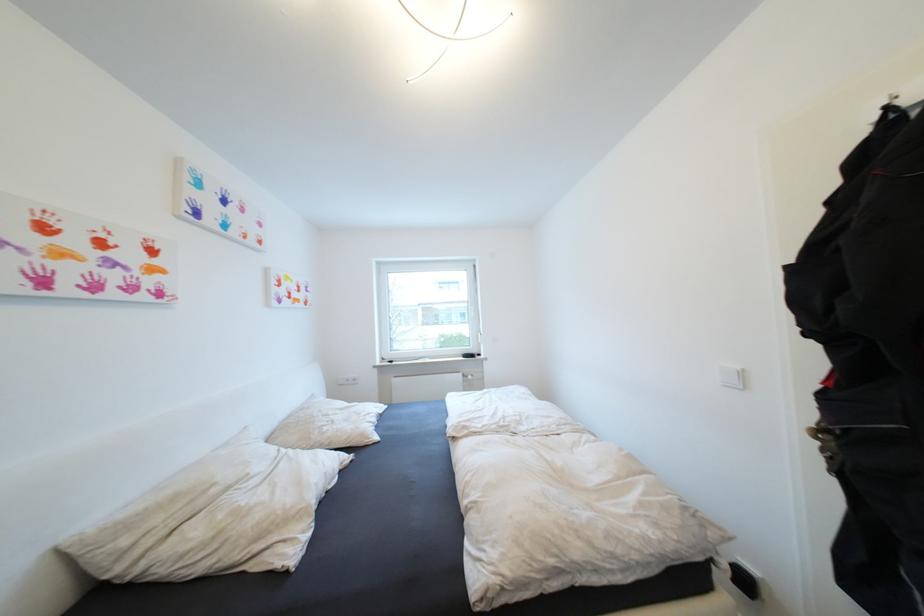
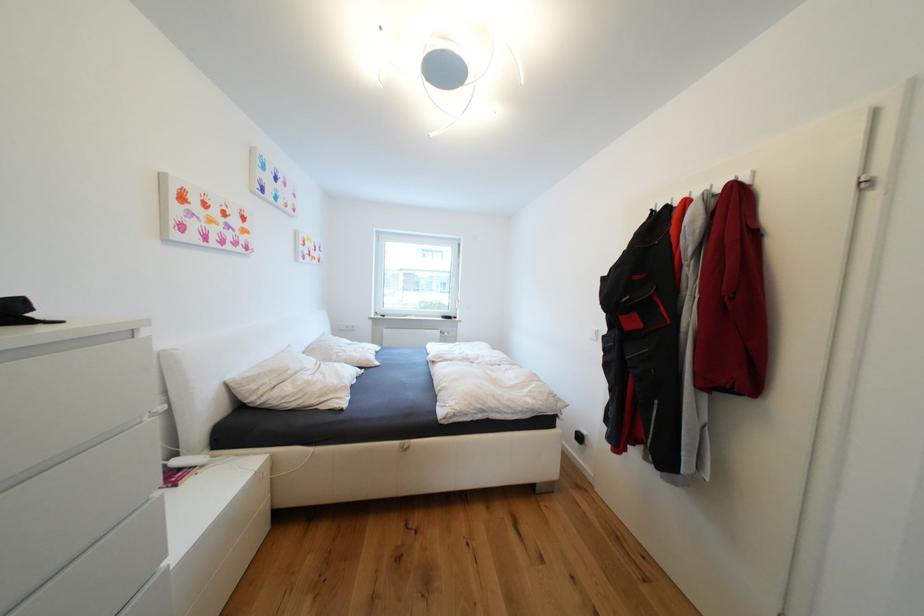
Where in the second image is the point corresponding to [235,490] from the first image?

(304, 374)